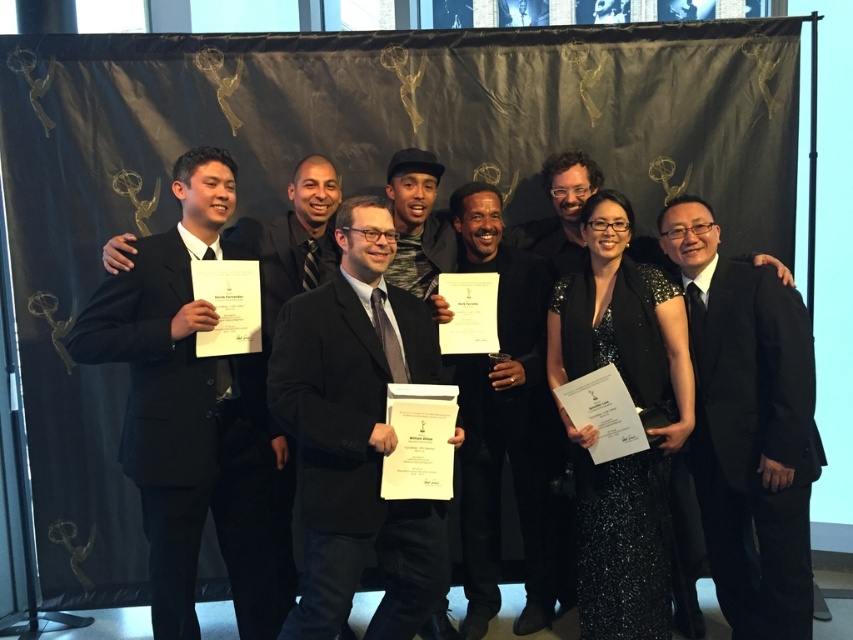
Question: Does black suit at left appear on the right side of matte black suit at center?

Choices:
 (A) yes
 (B) no

Answer: (B)

Question: In this image, where is black suit at left located relative to black matte suit at center?

Choices:
 (A) above
 (B) below

Answer: (A)

Question: Which point appears closest to the camera in this image?

Choices:
 (A) (190, 461)
 (B) (389, 541)
 (C) (735, 390)
 (D) (502, 291)

Answer: (B)

Question: Can you confirm if matte black suit at center is thinner than black matte suit at center?

Choices:
 (A) yes
 (B) no

Answer: (B)

Question: Which object is farther from the camera taking this photo?

Choices:
 (A) matte black suit at center
 (B) black matte suit at center

Answer: (B)

Question: Which point is closer to the camera taking this photo?

Choices:
 (A) (807, 497)
 (B) (231, 572)
 (C) (494, 556)

Answer: (A)